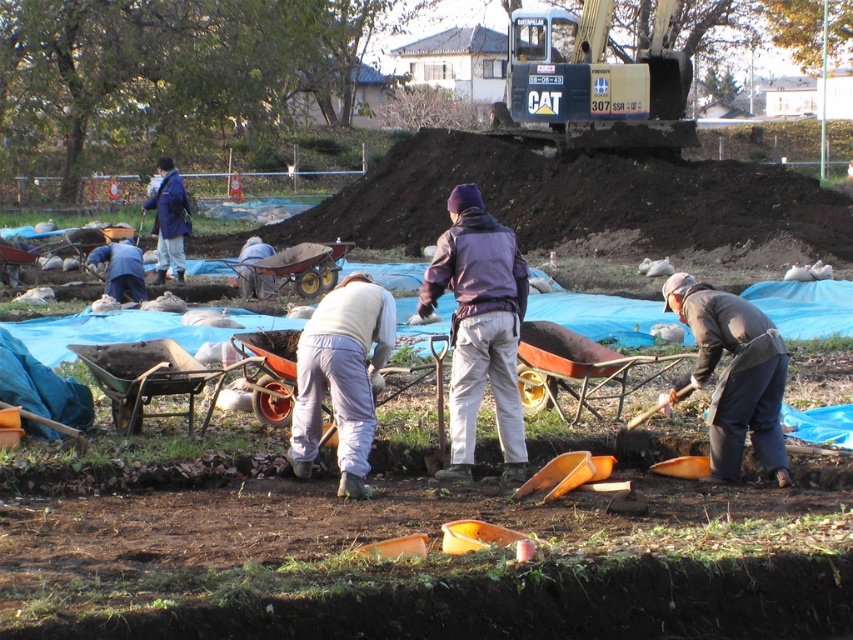
Describe the element at coordinates (573, 198) in the screenshot. I see `dark brown soil at upper center` at that location.

Between dark brown soil at upper center and light gray fabric pants at center, which one is positioned higher?

dark brown soil at upper center

Does point (368, 170) come behind point (271, 289)?

Yes, it is behind point (271, 289).

This screenshot has height=640, width=853. In order to click on dark brown soil at upper center in this screenshot , I will do click(x=573, y=198).

Between point (323, 264) and point (183, 221), which one is positioned behind?

The point (183, 221) is behind.

Does point (303, 292) come in front of point (158, 266)?

Yes.

Find the location of a particular element. orange rubber wheelbarrow at center is located at coordinates coord(294,269).

Between point (486, 241) and point (126, 241), which one is positioned in front?

Point (486, 241)

Is purple fabric jacket at center below light blue fabric at center?

Correct, purple fabric jacket at center is located below light blue fabric at center.

Does point (445, 259) come closer to viewer compared to point (131, 243)?

Yes, it is.

Image resolution: width=853 pixels, height=640 pixels. In order to click on purple fabric jacket at center in this screenshot , I will do `click(479, 326)`.